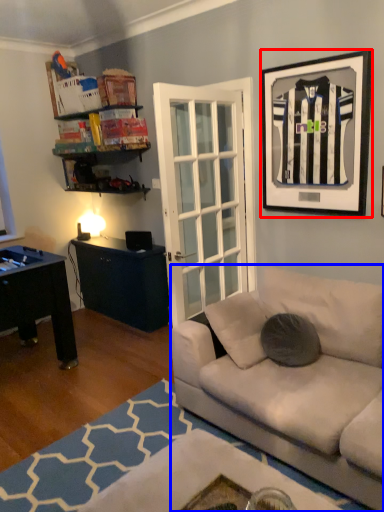
Question: Among these objects, which one is nearest to the camera, picture frame (highlighted by a red box) or studio couch (highlighted by a blue box)?

Choices:
 (A) picture frame
 (B) studio couch

Answer: (B)